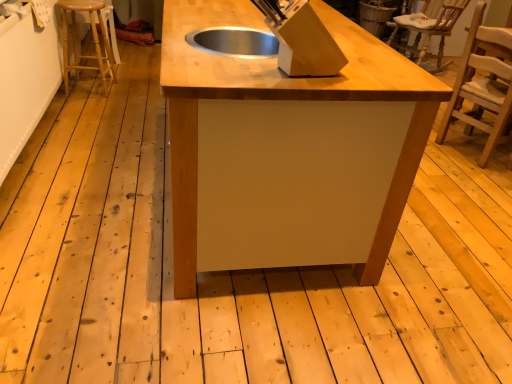
Question: Is light brown wooden stool at left wider or thinner than light brown wooden chair at right, marked as the 2th chair in a back-to-front arrangement?

Choices:
 (A) thin
 (B) wide

Answer: (A)

Question: Does point (79, 11) appear closer or farther from the camera than point (487, 99)?

Choices:
 (A) closer
 (B) farther

Answer: (B)

Question: Which object is the farthest from the light brown wooden stool at left?

Choices:
 (A) wooden chair at upper right, which is the 2th chair from front to back
 (B) matte wood table at center
 (C) light brown wooden chair at right, which ranks as the first chair in front-to-back order

Answer: (C)

Question: Estimate the real-world distances between objects in this image. Which object is farther from the light brown wooden chair at right, placed as the first chair when sorted from bottom to top?

Choices:
 (A) wooden chair at upper right, the 2th chair when ordered from bottom to top
 (B) light brown wooden stool at left
 (C) matte wood table at center

Answer: (B)